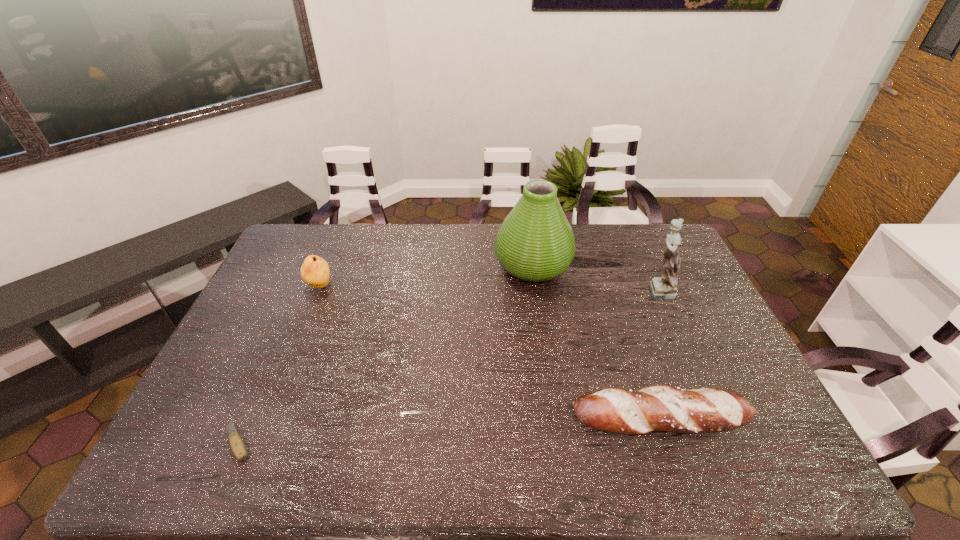
This screenshot has height=540, width=960. Find the location of `vase`. vase is located at coordinates (535, 242).

Find the location of a particular element. figurine is located at coordinates (665, 288).

Locate an element on the screen. This screenshot has height=540, width=960. the third tallest object is located at coordinates (315, 271).

This screenshot has width=960, height=540. I want to click on the fourth tallest object, so click(665, 408).

Locate an element on the screen. The image size is (960, 540). pocketknife is located at coordinates (237, 445).

Locate an element on the screen. The height and width of the screenshot is (540, 960). vacant region located 0.310m on the left of the vase is located at coordinates (407, 264).

You are a GUI agent. You are given a task and a screenshot of the screen. Output one action in this format:
    pyautogui.click(x=<x>, y=<y>)
    Task: Click on the free point located 0.120m on the front-facing side of the figurine
    Image resolution: width=960 pixels, height=540 pixels.
    Given the screenshot: What is the action you would take?
    pyautogui.click(x=604, y=290)

You are a GUI agent. You are given a task and a screenshot of the screen. Output one action in this format:
    pyautogui.click(x=<x>, y=<y>)
    Task: Click on the vacant space positioned 0.150m on the front-facing side of the figurine
    Image resolution: width=960 pixels, height=540 pixels.
    Given the screenshot: What is the action you would take?
    pyautogui.click(x=595, y=290)

I want to click on free point located 0.370m on the front-facing side of the figurine, so click(529, 290).

Identify the location of vacant space located 0.380m on the right of the pear. (446, 286).